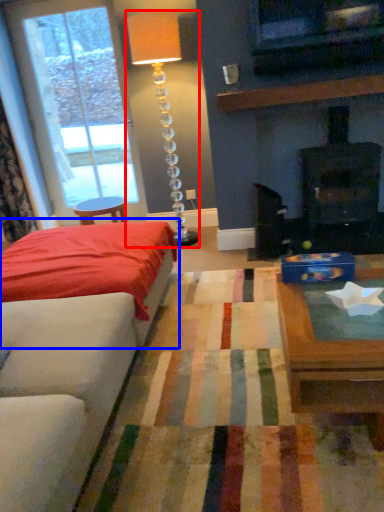
Question: Which object appears closest to the camera in this image, table lamp (highlighted by a red box) or bed (highlighted by a blue box)?

Choices:
 (A) table lamp
 (B) bed

Answer: (B)